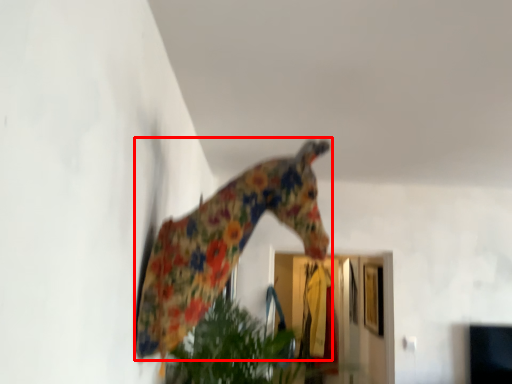
Question: From the image's perspective, where is giraffe (annotated by the red box) located in relation to glass door in the image?

Choices:
 (A) below
 (B) above

Answer: (B)